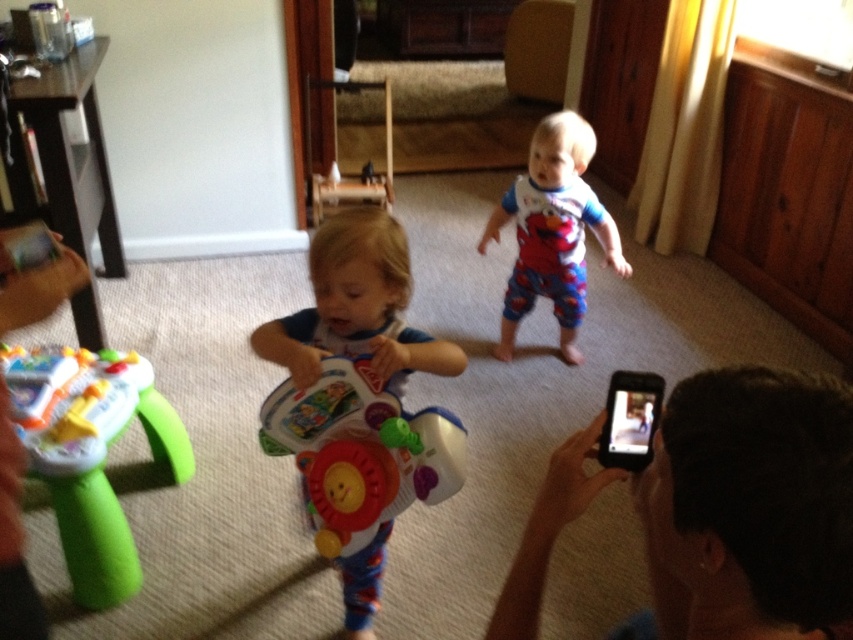
You are a parent trying to organize the toys in the room. You see the plastic toy at center and the white cotton pajamas at center. Which item is shorter?

The plastic toy at center is not as tall as white cotton pajamas at center, so the plastic toy at center is shorter.

You are a parent trying to locate your black plastic phone at lower right in the room. Based on the coordinates provided, where would you find it?

The black plastic phone at lower right is located at coordinates point [749,506], which means it is positioned near the bottom right corner of the room.